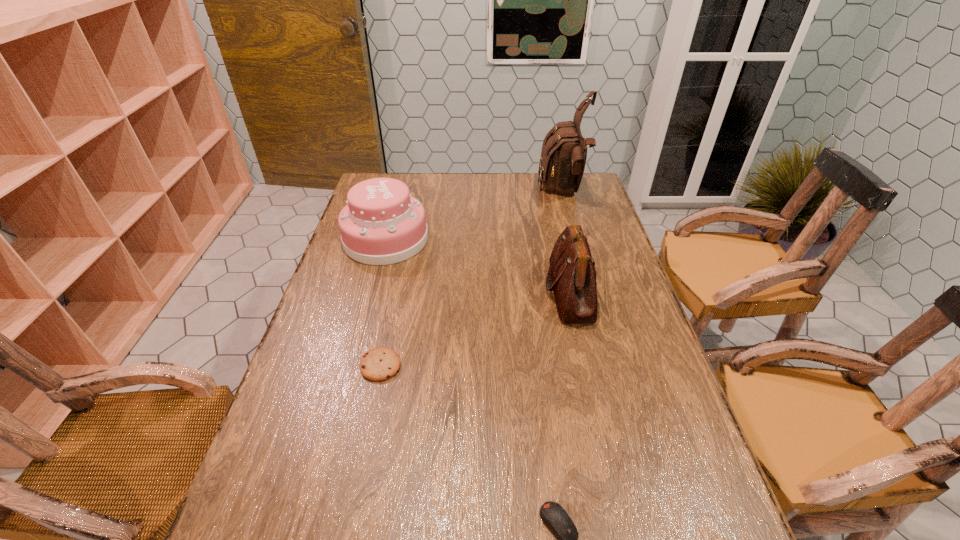
The image size is (960, 540). Find the location of `empty space between the birthday cake and the taller shoulder bag`. empty space between the birthday cake and the taller shoulder bag is located at coordinates (475, 216).

You are a GUI agent. You are given a task and a screenshot of the screen. Output one action in this format:
    pyautogui.click(x=<x>, y=<y>)
    Task: Click on the blank region between the second nearest object and the tallest object
    The height and width of the screenshot is (540, 960).
    Given the screenshot: What is the action you would take?
    pyautogui.click(x=472, y=279)

Locate an element on the screen. free space between the shorter shoulder bag and the second nearest object is located at coordinates coord(475,328).

Find the location of a particular element. vacant area between the tallest object and the fourth farthest object is located at coordinates (472, 279).

The height and width of the screenshot is (540, 960). I want to click on free space that is in between the shorter shoulder bag and the birthday cake, so click(x=478, y=265).

Find the location of a particular element. This screenshot has width=960, height=540. object that ranks as the third closest to the birthday cake is located at coordinates (564, 151).

Find the location of a particular element. The width and height of the screenshot is (960, 540). the third closest object to the cookie is located at coordinates (557, 520).

Identify the location of free spot that satisfies the following two spatial constraints: 1. on the front side of the birthday cake; 2. on the left side of the shorter shoulder bag. (372, 291).

The image size is (960, 540). In order to click on free location that satisfies the following two spatial constraints: 1. on the front side of the nearer shoulder bag; 2. on the right side of the birthday cake in this screenshot , I will do `click(372, 291)`.